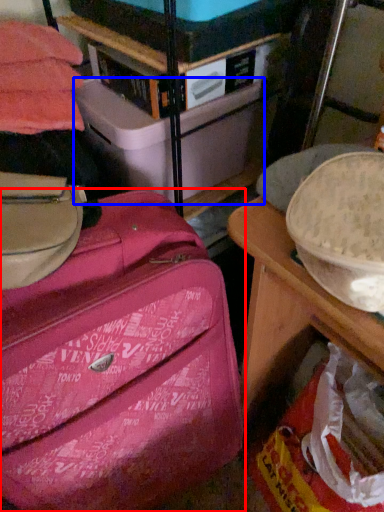
Question: Among these objects, which one is farthest to the camera, suitcase (highlighted by a red box) or storage box (highlighted by a blue box)?

Choices:
 (A) suitcase
 (B) storage box

Answer: (B)